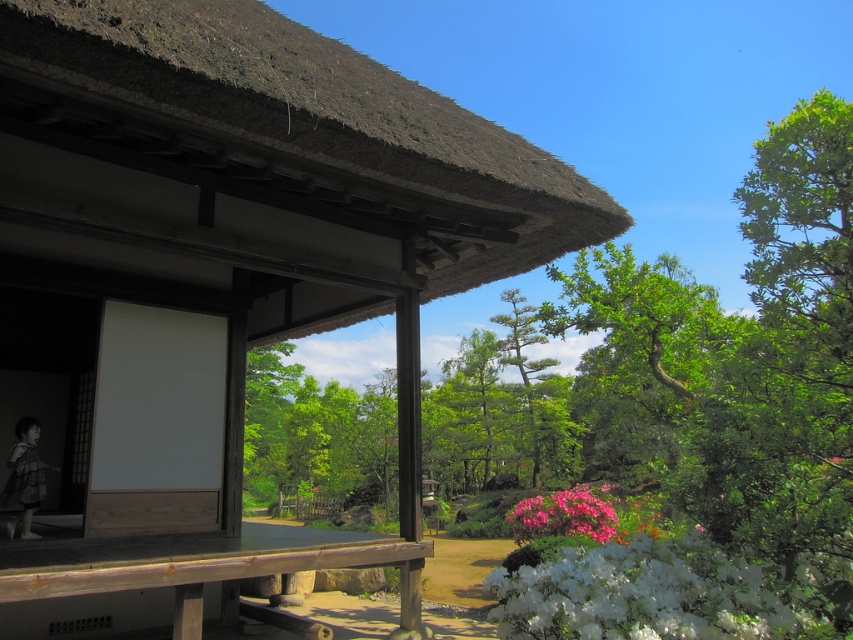
You are planning to set up a small garden in the area where the thatched roof hut at center and the wooden picnic table at center are located. Considering their heights, which object would require more space vertically?

The wooden picnic table at center requires more vertical space because it is taller than the thatched roof hut at center.

Consider the image. You are a visitor standing at the entrance of the thatched roof hut at center. Looking towards the green leafy tree at center, which object is higher in the scene?

The thatched roof hut at center is located above the green leafy tree at center, so the thatched roof hut at center is higher in the scene.